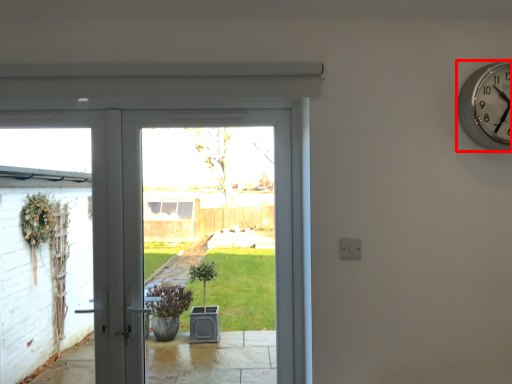
Question: In this image, where is wall clock (annotated by the red box) located relative to door?

Choices:
 (A) left
 (B) right

Answer: (B)